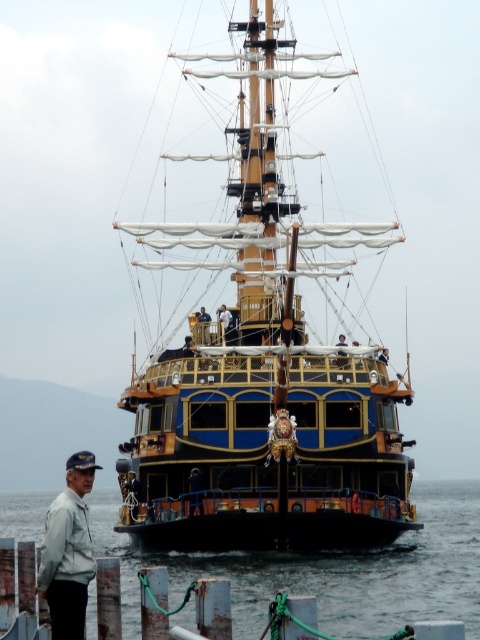
Question: Does wooden polished ship at center appear under transparent water at lower center?

Choices:
 (A) no
 (B) yes

Answer: (A)

Question: Which object appears closest to the camera in this image?

Choices:
 (A) transparent water at lower center
 (B) wooden polished ship at center
 (C) white matte jacket at lower left

Answer: (C)

Question: Which point is farther to the camera?

Choices:
 (A) (67, 576)
 (B) (127, 547)

Answer: (B)

Question: Is the position of transparent water at lower center more distant than that of white matte jacket at lower left?

Choices:
 (A) no
 (B) yes

Answer: (B)

Question: Can you confirm if transparent water at lower center is bigger than white matte jacket at lower left?

Choices:
 (A) no
 (B) yes

Answer: (B)

Question: Which point appears farthest from the camera in this image?

Choices:
 (A) (61, 531)
 (B) (464, 579)
 (C) (312, 346)

Answer: (B)